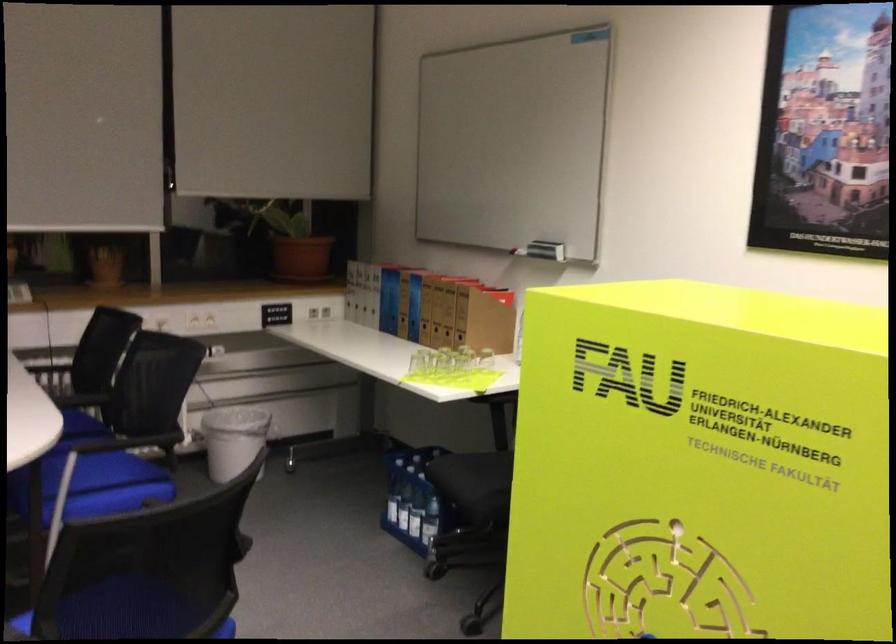
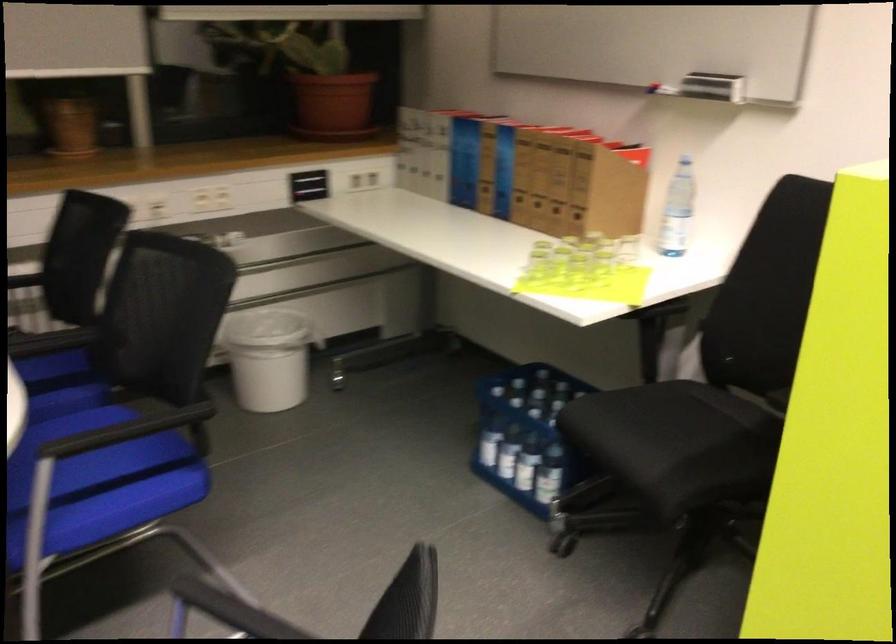
Question: The first image is from the beginning of the video and the second image is from the end. How did the camera likely rotate when shooting the video?

Choices:
 (A) Left
 (B) Right
 (C) Up
 (D) Down

Answer: (D)